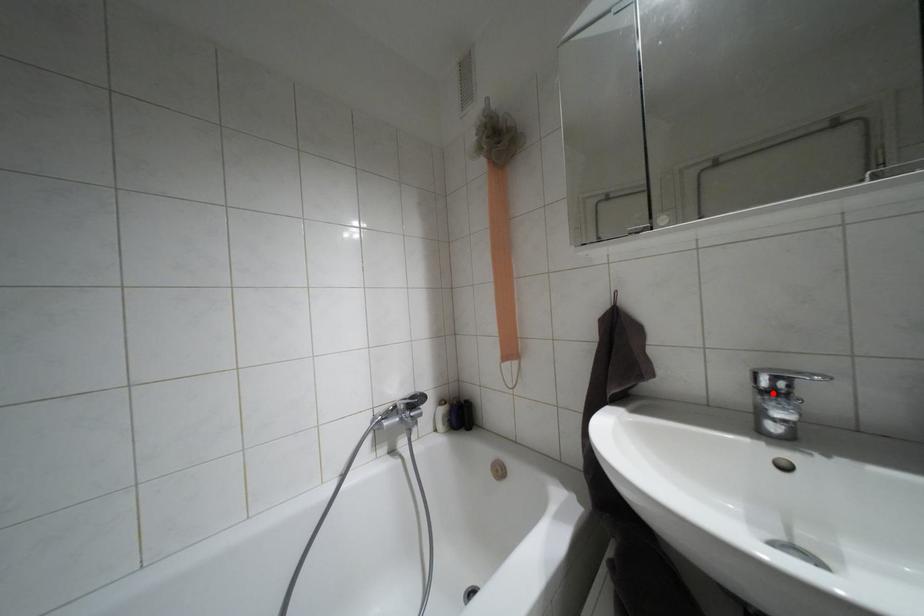
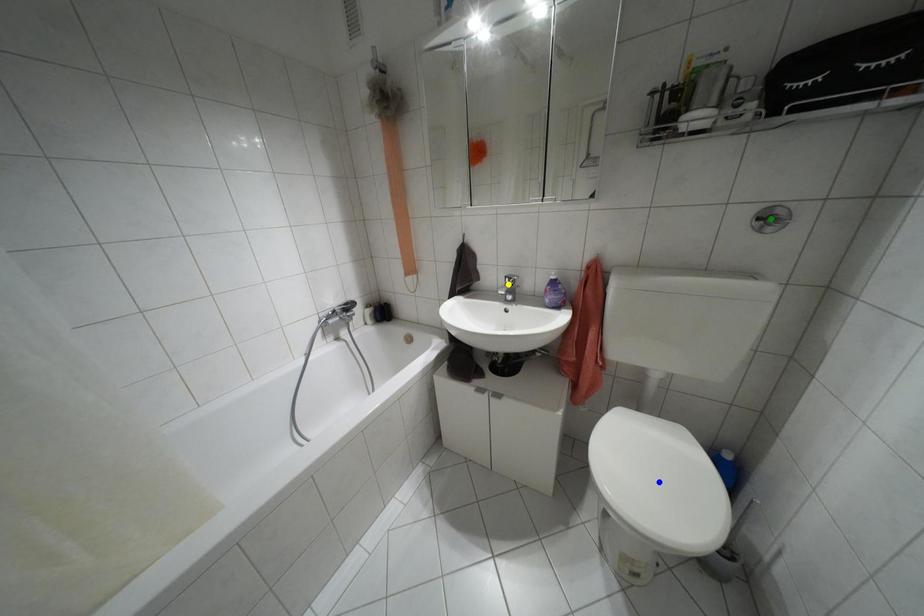
Question: I am providing you with two images of the same scene from different viewpoints. A red point is marked on the first image. You are given multiple points on the second image. Can you choose the point in image 2 that corresponds to the point in image 1?

Choices:
 (A) green point
 (B) blue point
 (C) yellow point

Answer: (C)